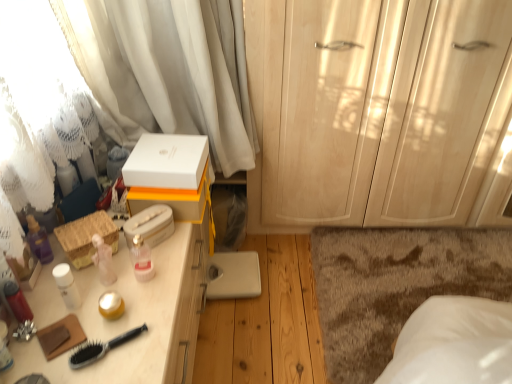
At what (x,y) coordinates should I click in order to perform the action: click on free location to the right of matte wood cabinet at right. Please return your answer as a coordinate pair (x, y). Looking at the image, I should click on (443, 256).